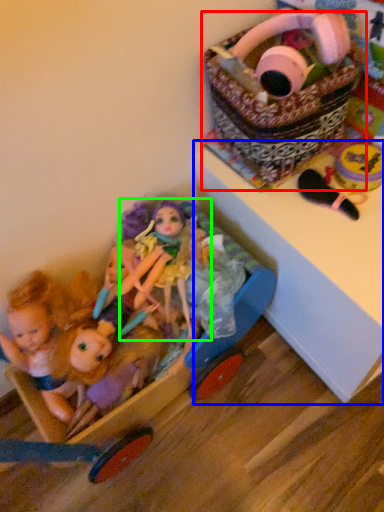
Question: Estimate the real-world distances between objects in this image. Which object is closer to basket (highlighted by a red box), changing table (highlighted by a blue box) or doll (highlighted by a green box)?

Choices:
 (A) changing table
 (B) doll

Answer: (A)